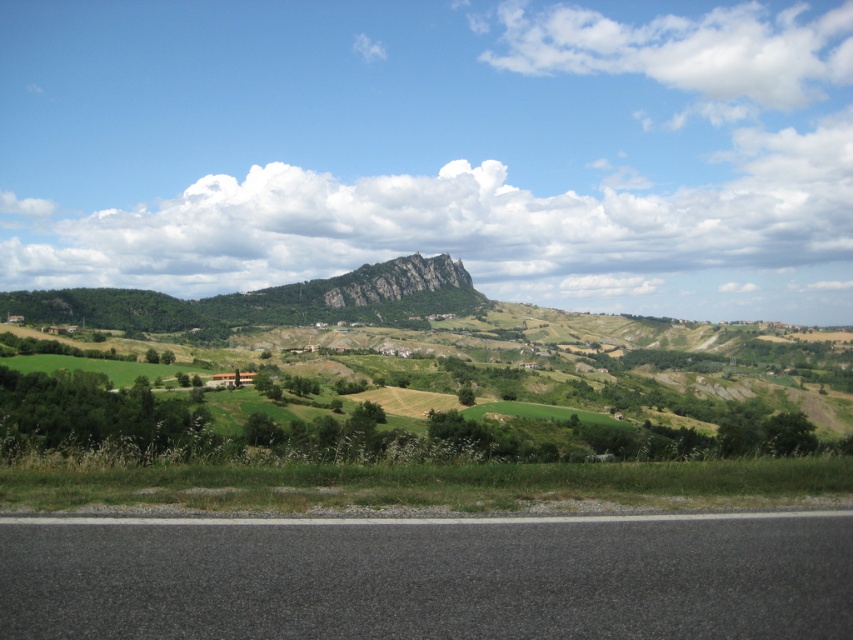
Who is positioned more to the right, white fluffy cloud at upper center or rugged stone mountain at center?

white fluffy cloud at upper center

Can you confirm if white fluffy cloud at upper center is thinner than rugged stone mountain at center?

No.

Locate an element on the screen. Image resolution: width=853 pixels, height=640 pixels. white fluffy cloud at upper center is located at coordinates (688, 49).

The image size is (853, 640). What are the coordinates of `white fluffy cloud at upper center` in the screenshot? It's located at (688, 49).

Does white fluffy cloud at center appear under rugged stone mountain at center?

Incorrect, white fluffy cloud at center is not positioned below rugged stone mountain at center.

Describe the element at coordinates (480, 230) in the screenshot. The width and height of the screenshot is (853, 640). I see `white fluffy cloud at center` at that location.

Identify the location of white fluffy cloud at center. (480, 230).

Between white fluffy cloud at center and white fluffy cloud at upper center, which one has more height?

white fluffy cloud at center is taller.

Does point (231, 184) come closer to viewer compared to point (619, 56)?

Yes, point (231, 184) is closer to viewer.

Which is in front, point (605, 198) or point (570, 17)?

Positioned in front is point (605, 198).

Locate an element on the screen. The image size is (853, 640). white fluffy cloud at center is located at coordinates (480, 230).